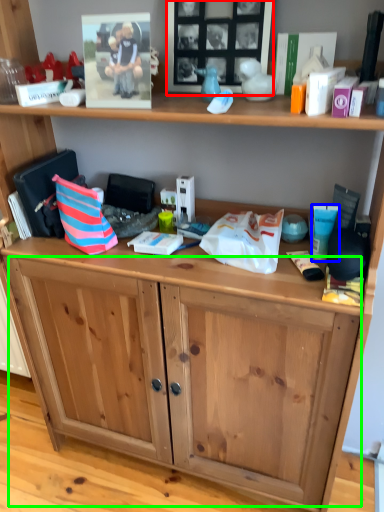
Question: Considering the real-world distances, which object is farthest from picture frame (highlighted by a red box)? toiletry (highlighted by a blue box) or drawer (highlighted by a green box)?

Choices:
 (A) toiletry
 (B) drawer

Answer: (B)